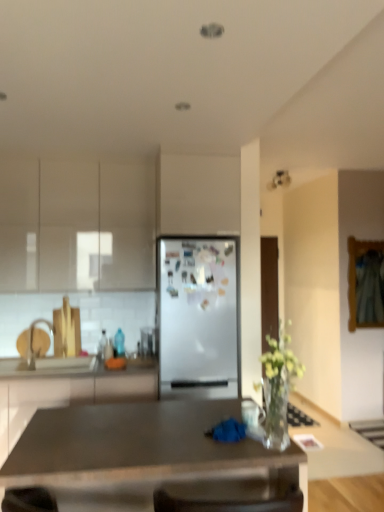
Question: Is clear glass vase at center next to white glossy countertop at lower left and touching it?

Choices:
 (A) no
 (B) yes

Answer: (A)

Question: Could you tell me if clear glass vase at center is turned towards white glossy countertop at lower left?

Choices:
 (A) yes
 (B) no

Answer: (B)

Question: From the image's perspective, is clear glass vase at center located beneath white glossy countertop at lower left?

Choices:
 (A) yes
 (B) no

Answer: (B)

Question: Is clear glass vase at center positioned before white glossy countertop at lower left?

Choices:
 (A) no
 (B) yes

Answer: (B)

Question: Is clear glass vase at center not close to white glossy countertop at lower left?

Choices:
 (A) yes
 (B) no

Answer: (A)

Question: Considering the positions of point (74, 434) and point (51, 378), is point (74, 434) closer or farther from the camera than point (51, 378)?

Choices:
 (A) closer
 (B) farther

Answer: (A)

Question: Based on their positions, is matte gray desk at center located to the left or right of white glossy cabinet at left, the first cabinetry in the bottom-to-top sequence?

Choices:
 (A) right
 (B) left

Answer: (A)

Question: Relative to white glossy cabinet at left, the first cabinetry in the bottom-to-top sequence, is matte gray desk at center in front or behind?

Choices:
 (A) behind
 (B) front

Answer: (B)

Question: From their relative heights in the image, would you say matte gray desk at center is taller or shorter than white glossy cabinet at left, acting as the second cabinetry starting from the top?

Choices:
 (A) short
 (B) tall

Answer: (A)

Question: Relative to white matte refrigerator at center, is matte white cabinets at upper left, which is counted as the first cabinetry, starting from the top, in front or behind?

Choices:
 (A) behind
 (B) front

Answer: (A)

Question: From a real-world perspective, is matte white cabinets at upper left, placed as the 2th cabinetry when sorted from bottom to top, physically located above or below white matte refrigerator at center?

Choices:
 (A) below
 (B) above

Answer: (B)

Question: Does point (94, 271) appear closer or farther from the camera than point (182, 263)?

Choices:
 (A) farther
 (B) closer

Answer: (A)

Question: Is matte white cabinets at upper left, which is counted as the first cabinetry, starting from the top, spatially inside white matte refrigerator at center, or outside of it?

Choices:
 (A) inside
 (B) outside

Answer: (B)

Question: In terms of size, does white glossy cabinet at left, acting as the second cabinetry starting from the top, appear bigger or smaller than clear glass vase at center?

Choices:
 (A) small
 (B) big

Answer: (B)

Question: Considering their positions, is white glossy cabinet at left, the first cabinetry in the bottom-to-top sequence, located in front of or behind clear glass vase at center?

Choices:
 (A) behind
 (B) front

Answer: (A)